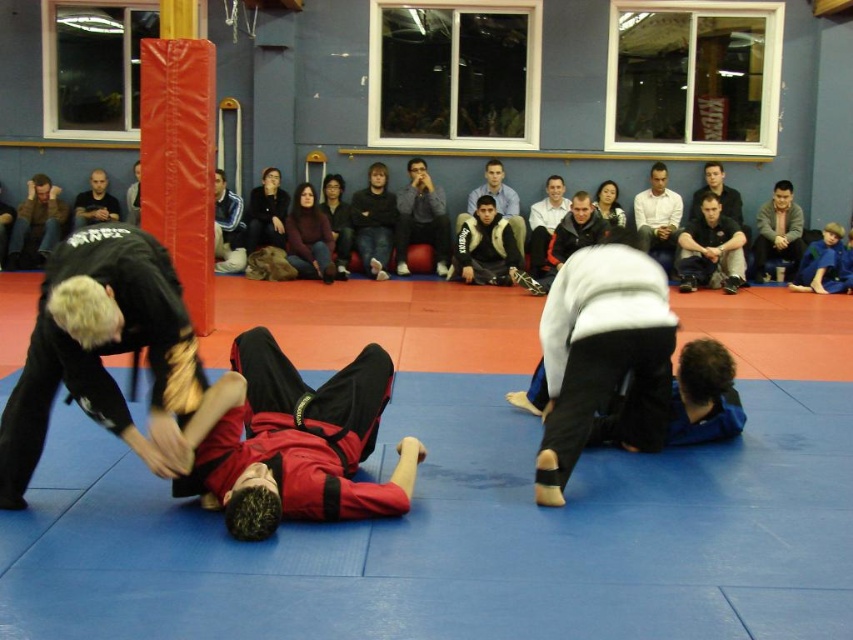
Does red matte uniform at center have a smaller size compared to dark gray fleece jacket at center?

Actually, red matte uniform at center might be larger than dark gray fleece jacket at center.

Does red matte uniform at center appear over dark gray fleece jacket at center?

No, red matte uniform at center is not above dark gray fleece jacket at center.

Locate an element on the screen. The height and width of the screenshot is (640, 853). red matte uniform at center is located at coordinates (292, 442).

Does dark gray fabric shirt at center have a larger size compared to dark gray sweater at upper right?

Yes, dark gray fabric shirt at center is bigger than dark gray sweater at upper right.

Describe the element at coordinates (711, 250) in the screenshot. I see `dark gray fabric shirt at center` at that location.

Consider the image. Measure the distance between point (706, 257) and camera.

Point (706, 257) and camera are 36.20 feet apart from each other.

Locate an element on the screen. The image size is (853, 640). dark gray fabric shirt at center is located at coordinates (711, 250).

Does dark blue jeans at center have a greater height compared to dark gray sweater at upper right?

Correct, dark blue jeans at center is much taller as dark gray sweater at upper right.

Does dark blue jeans at center have a lesser height compared to dark gray sweater at upper right?

No, dark blue jeans at center is not shorter than dark gray sweater at upper right.

The width and height of the screenshot is (853, 640). Identify the location of dark blue jeans at center. (373, 221).